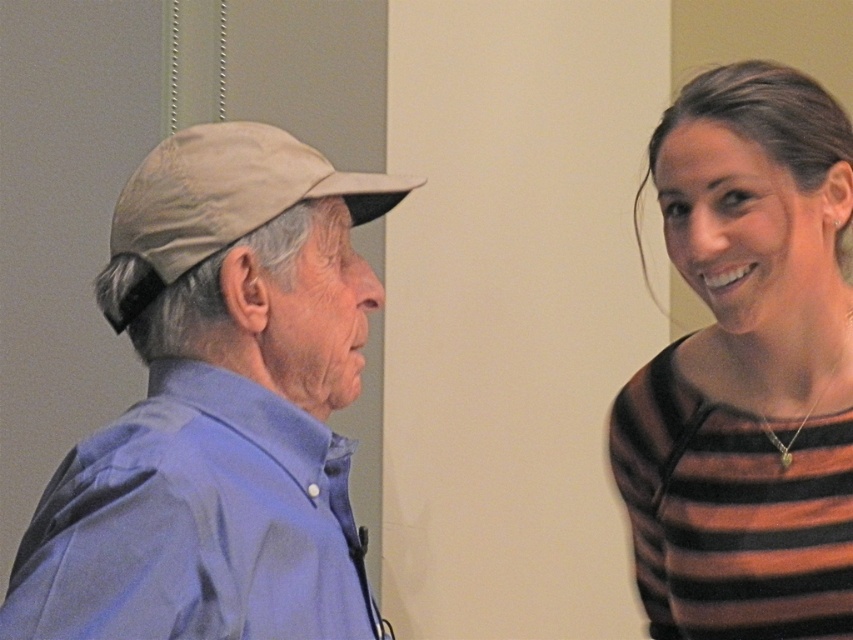
Question: Can you confirm if brown striped sweater at right is positioned to the right of tan fabric baseball cap at left?

Choices:
 (A) yes
 (B) no

Answer: (A)

Question: Which is farther from the blue smooth shirt at left?

Choices:
 (A) matte khaki cap at left
 (B) tan fabric baseball cap at left

Answer: (B)

Question: Which point appears closest to the camera in this image?

Choices:
 (A) (57, 628)
 (B) (189, 230)
 (C) (668, 470)

Answer: (A)

Question: Does brown striped sweater at right appear on the right side of blue smooth shirt at left?

Choices:
 (A) no
 (B) yes

Answer: (B)

Question: Which point is farther to the camera?

Choices:
 (A) matte khaki cap at left
 (B) tan fabric baseball cap at left
 (C) blue smooth shirt at left

Answer: (B)

Question: Can you confirm if brown striped sweater at right is positioned below blue smooth shirt at left?

Choices:
 (A) yes
 (B) no

Answer: (B)